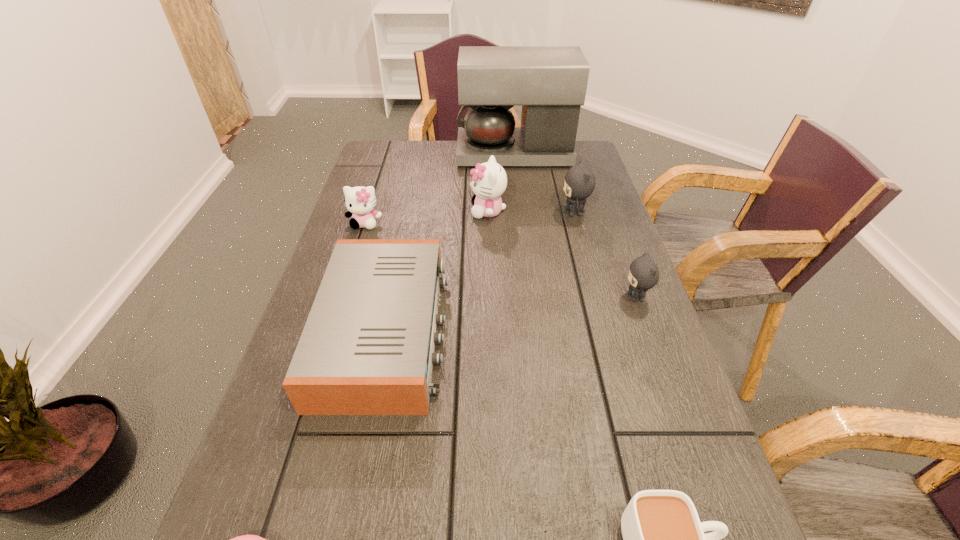
Where is `the farthest object`? The width and height of the screenshot is (960, 540). the farthest object is located at coordinates (550, 82).

Where is `the tallest object`? the tallest object is located at coordinates (550, 82).

You are a GUI agent. You are given a task and a screenshot of the screen. Output one action in this format:
    pyautogui.click(x=<x>, y=<y>)
    Task: Click on the right white kitten
    The height and width of the screenshot is (540, 960).
    Given the screenshot: What is the action you would take?
    pyautogui.click(x=489, y=180)

Find the location of a particular element. the second kitten from left to right is located at coordinates (489, 180).

Image resolution: width=960 pixels, height=540 pixels. I want to click on the left gray kitten, so click(x=579, y=184).

This screenshot has height=540, width=960. Identify the location of the second kitten from right to left. (579, 184).

Find the location of a particular element. This screenshot has width=960, height=540. the leftmost kitten is located at coordinates (360, 201).

Find the location of a particular element. This screenshot has width=960, height=540. the left white kitten is located at coordinates (360, 201).

Locate an element on the screen. This screenshot has width=960, height=540. the rightmost kitten is located at coordinates (643, 274).

The width and height of the screenshot is (960, 540). In order to click on the nearest kitten in this screenshot , I will do `click(643, 274)`.